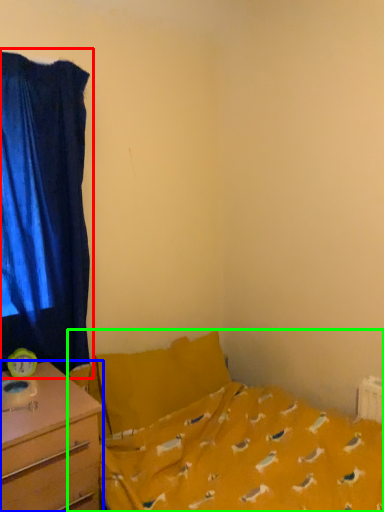
Question: Estimate the real-world distances between objects in this image. Which object is farther from curtain (highlighted by a red box), desk (highlighted by a blue box) or bed (highlighted by a green box)?

Choices:
 (A) desk
 (B) bed

Answer: (B)